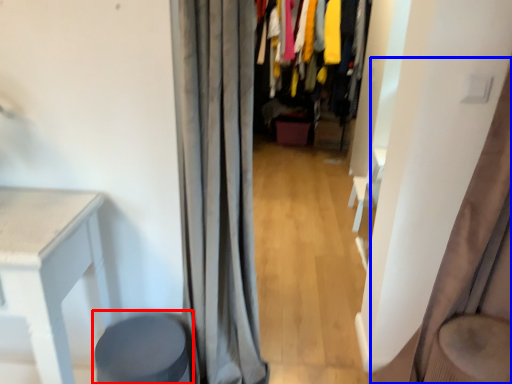
Question: Which of the following is the closest to the observer, music stool (highlighted by a red box) or curtain (highlighted by a blue box)?

Choices:
 (A) music stool
 (B) curtain

Answer: (B)